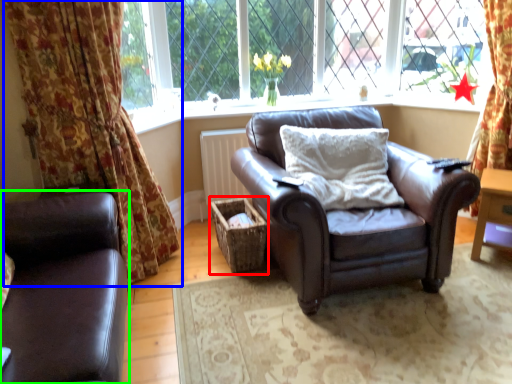
Question: Considering the real-world distances, which object is farthest from crate (highlighted by a red box)? curtain (highlighted by a blue box) or studio couch (highlighted by a green box)?

Choices:
 (A) curtain
 (B) studio couch

Answer: (B)